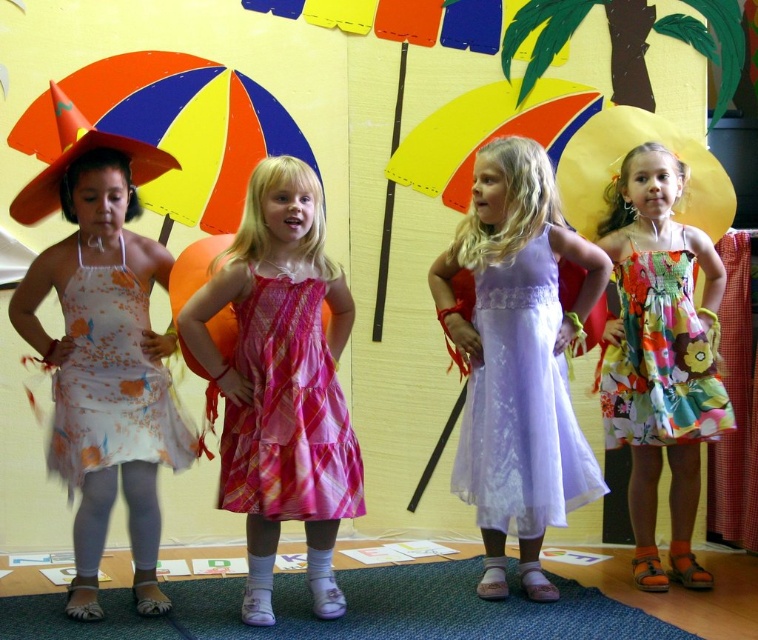
Can you confirm if floral cotton dress at center is positioned above yellow fabric umbrella at center?

No.

Does floral cotton dress at center have a greater height compared to yellow fabric umbrella at center?

Correct, floral cotton dress at center is much taller as yellow fabric umbrella at center.

What do you see at coordinates (659, 356) in the screenshot? I see `floral cotton dress at center` at bounding box center [659, 356].

Identify the location of floral cotton dress at center. (659, 356).

Does floral cotton dress at center appear on the right side of lavender sheer dress at center?

Indeed, floral cotton dress at center is positioned on the right side of lavender sheer dress at center.

Does floral cotton dress at center have a larger size compared to lavender sheer dress at center?

Indeed, floral cotton dress at center has a larger size compared to lavender sheer dress at center.

Identify the location of floral cotton dress at center. (659, 356).

Is pink satin dress at center thinner than matte floral dress at left?

Indeed, pink satin dress at center has a lesser width compared to matte floral dress at left.

The width and height of the screenshot is (758, 640). I want to click on pink satin dress at center, so click(280, 381).

The width and height of the screenshot is (758, 640). What are the coordinates of `pink satin dress at center` in the screenshot? It's located at (280, 381).